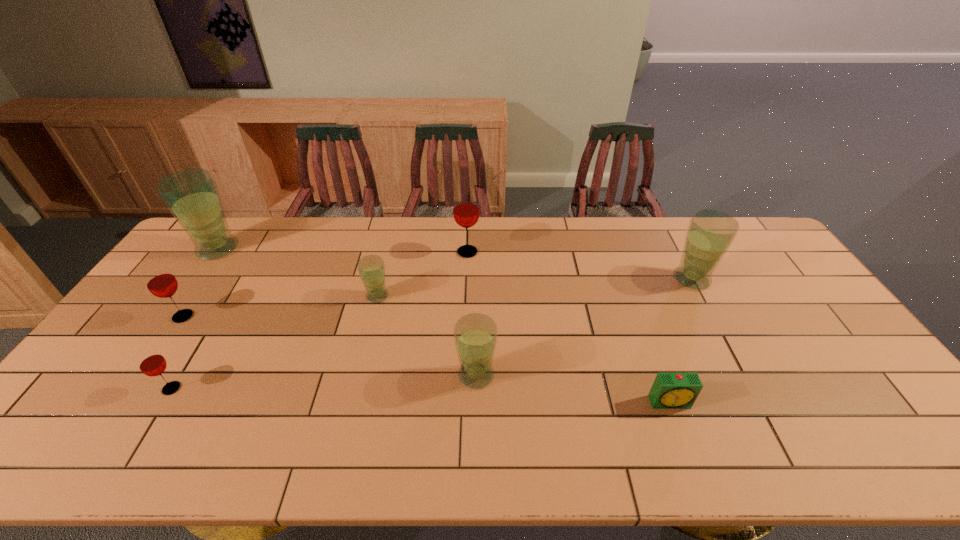
Identify the location of free space that satisfies the following two spatial constraints: 1. on the back side of the third glass from left to right; 2. on the right side of the farthest red glass. This screenshot has width=960, height=540. (254, 252).